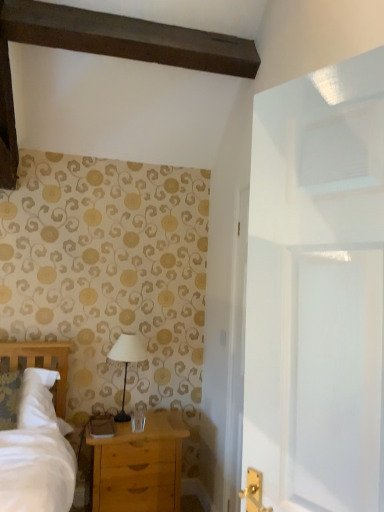
Describe the element at coordinates (139, 466) in the screenshot. This screenshot has height=512, width=384. I see `light brown wooden chest of drawers at lower left` at that location.

You are a GUI agent. You are given a task and a screenshot of the screen. Output one action in this format:
    pyautogui.click(x=<x>, y=<y>)
    Task: Click on the light brown wooden chest of drawers at lower left
    The image size is (384, 512).
    Given the screenshot: What is the action you would take?
    pyautogui.click(x=139, y=466)

Measure the distance between point (x=166, y=458) and camera.

2.42 meters.

The height and width of the screenshot is (512, 384). In order to click on white fabric lampshade at center in this screenshot , I will do `click(127, 362)`.

What is the approximate width of white fabric lampshade at center?

It is 7.55 inches.

The width and height of the screenshot is (384, 512). Describe the element at coordinates (127, 362) in the screenshot. I see `white fabric lampshade at center` at that location.

This screenshot has width=384, height=512. Find the location of `light brown wooden chest of drawers at lower left`. light brown wooden chest of drawers at lower left is located at coordinates (139, 466).

Consider the image. Between white fabric lampshade at center and light brown wooden chest of drawers at lower left, which one appears on the left side from the viewer's perspective?

From the viewer's perspective, white fabric lampshade at center appears more on the left side.

Between white fabric lampshade at center and light brown wooden chest of drawers at lower left, which one is positioned behind?

white fabric lampshade at center is behind.

Is point (131, 360) closer to camera compared to point (106, 490)?

That is False.

In the scene shown: From the image's perspective, is white fabric lampshade at center above or below light brown wooden chest of drawers at lower left?

white fabric lampshade at center is above light brown wooden chest of drawers at lower left.

From a real-world perspective, is white fabric lampshade at center under light brown wooden chest of drawers at lower left?

Incorrect, from a real-world perspective, white fabric lampshade at center is higher than light brown wooden chest of drawers at lower left.

Based on the photo, considering the relative sizes of white fabric lampshade at center and light brown wooden chest of drawers at lower left in the image provided, is white fabric lampshade at center wider than light brown wooden chest of drawers at lower left?

No.

Looking at this image, from their relative heights in the image, would you say white fabric lampshade at center is taller or shorter than light brown wooden chest of drawers at lower left?

white fabric lampshade at center is shorter than light brown wooden chest of drawers at lower left.

Can you confirm if white fabric lampshade at center is smaller than light brown wooden chest of drawers at lower left?

Correct, white fabric lampshade at center occupies less space than light brown wooden chest of drawers at lower left.

Do you think white fabric lampshade at center is within light brown wooden chest of drawers at lower left, or outside of it?

white fabric lampshade at center is outside light brown wooden chest of drawers at lower left.

Would you say white fabric lampshade at center is a long distance from light brown wooden chest of drawers at lower left?

No, white fabric lampshade at center is in close proximity to light brown wooden chest of drawers at lower left.

Could you tell me if white fabric lampshade at center is facing light brown wooden chest of drawers at lower left?

No, white fabric lampshade at center is not facing towards light brown wooden chest of drawers at lower left.

Can you tell me how much white fabric lampshade at center and light brown wooden chest of drawers at lower left differ in facing direction?

The facing directions of white fabric lampshade at center and light brown wooden chest of drawers at lower left are 0.507 degrees apart.

I want to click on chest of drawers that is on the right side of white fabric lampshade at center, so click(139, 466).

Based on their positions, is light brown wooden chest of drawers at lower left located to the left or right of white fabric lampshade at center?

In the image, light brown wooden chest of drawers at lower left appears on the right side of white fabric lampshade at center.

In the image, is light brown wooden chest of drawers at lower left positioned in front of or behind white fabric lampshade at center?

In the image, light brown wooden chest of drawers at lower left appears in front of white fabric lampshade at center.

Is point (138, 479) closer or farther from the camera than point (137, 338)?

Point (138, 479) is closer to the camera than point (137, 338).

From the image's perspective, is light brown wooden chest of drawers at lower left above white fabric lampshade at center?

No, from the image's perspective, light brown wooden chest of drawers at lower left is not above white fabric lampshade at center.

From a real-world perspective, is light brown wooden chest of drawers at lower left above or below white fabric lampshade at center?

Clearly, from a real-world perspective, light brown wooden chest of drawers at lower left is below white fabric lampshade at center.

Between light brown wooden chest of drawers at lower left and white fabric lampshade at center, which one has smaller width?

Thinner between the two is white fabric lampshade at center.

Which of these two, light brown wooden chest of drawers at lower left or white fabric lampshade at center, stands shorter?

white fabric lampshade at center.

Is light brown wooden chest of drawers at lower left bigger than white fabric lampshade at center?

Indeed, light brown wooden chest of drawers at lower left has a larger size compared to white fabric lampshade at center.

Is light brown wooden chest of drawers at lower left situated inside white fabric lampshade at center or outside?

The correct answer is: outside.

Is light brown wooden chest of drawers at lower left far away from white fabric lampshade at center?

light brown wooden chest of drawers at lower left is near white fabric lampshade at center, not far away.

Is light brown wooden chest of drawers at lower left facing towards white fabric lampshade at center?

No, light brown wooden chest of drawers at lower left is not aimed at white fabric lampshade at center.

Locate an element on the screen. This screenshot has width=384, height=512. table lamp behind the light brown wooden chest of drawers at lower left is located at coordinates (127, 362).

This screenshot has height=512, width=384. Find the location of `chest of drawers on the right of white fabric lampshade at center`. chest of drawers on the right of white fabric lampshade at center is located at coordinates (139, 466).

At what (x,y) coordinates should I click in order to perform the action: click on chest of drawers in front of the white fabric lampshade at center. Please return your answer as a coordinate pair (x, y). This screenshot has height=512, width=384. Looking at the image, I should click on (139, 466).